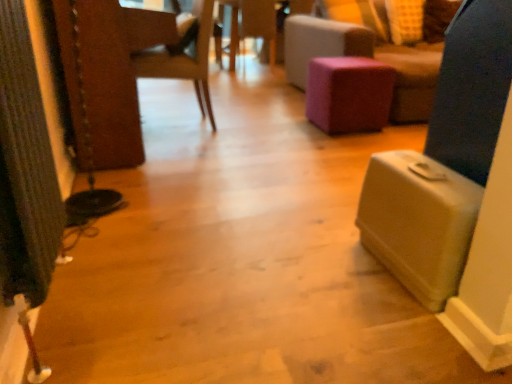
Where is `unoccupied region to the right of wooden chair at center`? Image resolution: width=512 pixels, height=384 pixels. unoccupied region to the right of wooden chair at center is located at coordinates (250, 124).